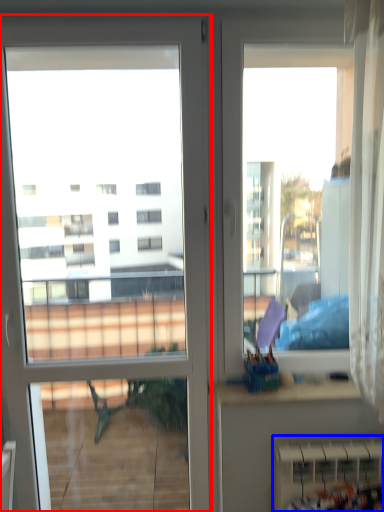
Question: Which object is further to the camera taking this photo, door (highlighted by a red box) or radiator (highlighted by a blue box)?

Choices:
 (A) door
 (B) radiator

Answer: (B)